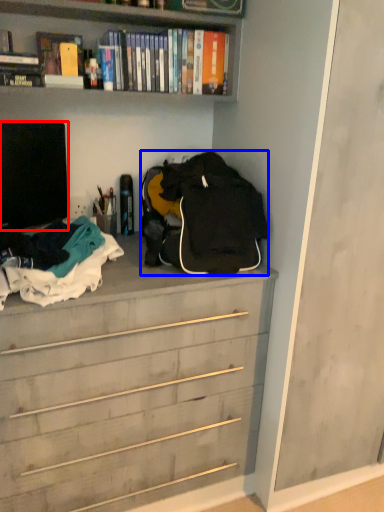
Question: Which object appears closest to the camera in this image, television (highlighted by a red box) or backpack (highlighted by a blue box)?

Choices:
 (A) television
 (B) backpack

Answer: (B)